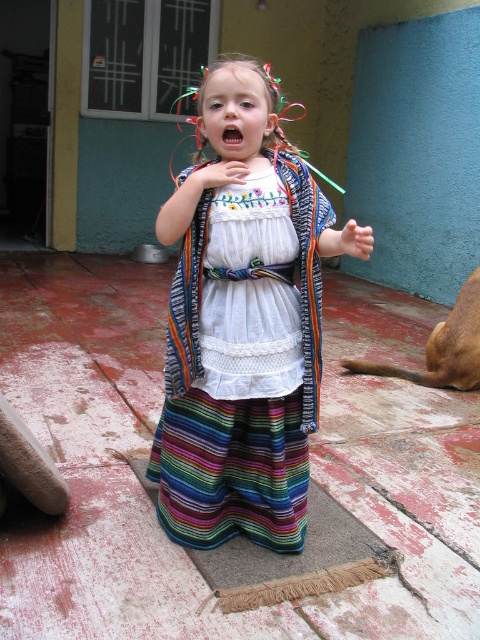
You are a tailor who needs to hang two dresses in your shop window. The shop window is 10 centimeters wide. You have the striped cotton dress at center and the white embroidered dress at center. Can both dresses fit side by side in the window?

The striped cotton dress at center and the white embroidered dress at center are 10.12 centimeters apart, so they cannot fit side by side in a 10 centimeter wide window as the total width required exceeds the available space.

You are a photographer trying to capture the child in the scene. You notice the striped cotton dress at center and the white embroidered dress at center. Which dress should you focus on to ensure it appears larger in the photo?

The striped cotton dress at center is closer to the viewer than the white embroidered dress at center, so focusing on the striped cotton dress at center will make it appear larger in the photo.

Consider the image. You are a photographer trying to capture the child in the white embroidered dress at center and the brown fur dog at lower right. Which object is positioned to the right side of the other?

The white embroidered dress at center is to the left of the brown fur dog at lower right, so the brown fur dog at lower right is positioned to the right side of the white embroidered dress at center.